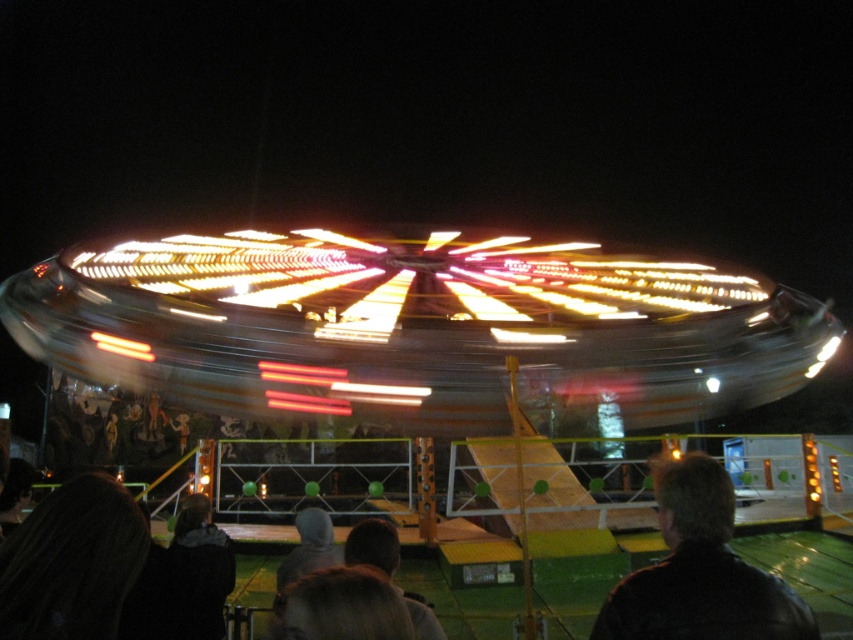
Based on the photo, is dark hair at lower left to the left of dark gray hoodie at lower left from the viewer's perspective?

Yes, dark hair at lower left is to the left of dark gray hoodie at lower left.

Is point (80, 614) positioned behind point (210, 508)?

No.

Between point (102, 572) and point (195, 536), which one is positioned in front?

Positioned in front is point (102, 572).

Find the location of a particular element. dark hair at lower left is located at coordinates (73, 563).

Who is positioned more to the left, black leather jacket at center or dark gray hoodie at lower left?

Positioned to the left is dark gray hoodie at lower left.

Does black leather jacket at center appear under dark gray hoodie at lower left?

Yes.

Who is more forward, (635, 598) or (183, 536)?

Point (635, 598) is more forward.

The image size is (853, 640). I want to click on black leather jacket at center, so click(700, 572).

Is metallic shiny carousel at center to the right of dark hair at lower left from the viewer's perspective?

Indeed, metallic shiny carousel at center is positioned on the right side of dark hair at lower left.

Is point (747, 406) positioned behind point (128, 556)?

Yes.

Is point (614, 417) in front of point (115, 570)?

No, (614, 417) is behind (115, 570).

You are a GUI agent. You are given a task and a screenshot of the screen. Output one action in this format:
    pyautogui.click(x=<x>, y=<y>)
    Task: Click on the metallic shiny carousel at center
    
    Given the screenshot: What is the action you would take?
    pyautogui.click(x=416, y=330)